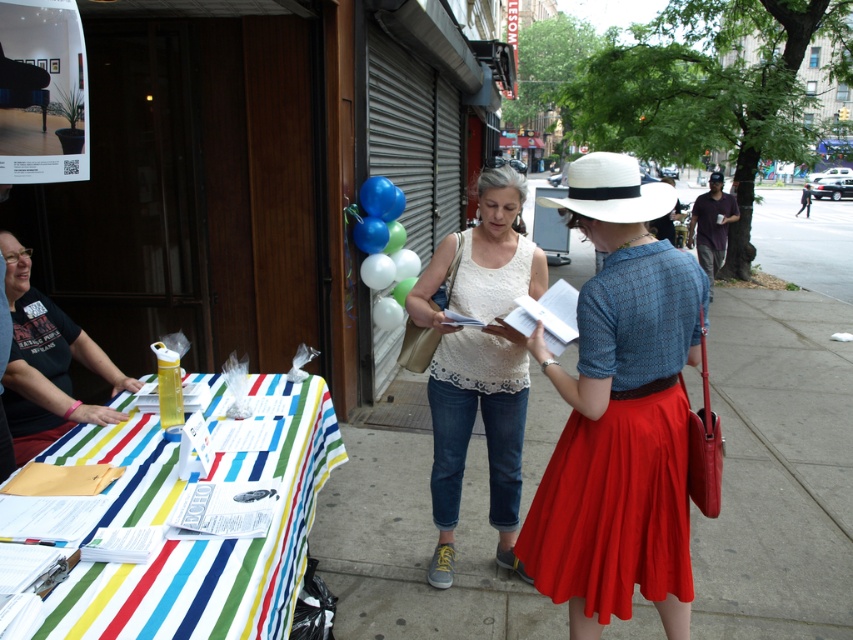
Which is more to the right, smooth concrete sidewalk at center or white lace tank top at center?

white lace tank top at center

Can you confirm if smooth concrete sidewalk at center is shorter than white lace tank top at center?

Yes.

Measure the distance between point (x=786, y=500) and camera.

They are 3.99 meters apart.

Where is `smooth concrete sidewalk at center`? This screenshot has height=640, width=853. smooth concrete sidewalk at center is located at coordinates (778, 470).

Which is more to the right, smooth concrete sidewalk at center or white glossy balloons at center?

white glossy balloons at center

Who is lower down, smooth concrete sidewalk at center or white glossy balloons at center?

smooth concrete sidewalk at center is below.

At what (x,y) coordinates should I click in order to perform the action: click on smooth concrete sidewalk at center. Please return your answer as a coordinate pair (x, y). The width and height of the screenshot is (853, 640). Looking at the image, I should click on (778, 470).

How distant is striped fabric table at lower left from white glossy balloons at center?

They are 8.07 feet apart.

Locate an element on the screen. The height and width of the screenshot is (640, 853). striped fabric table at lower left is located at coordinates (218, 547).

This screenshot has width=853, height=640. In order to click on striped fabric table at lower left in this screenshot , I will do `click(218, 547)`.